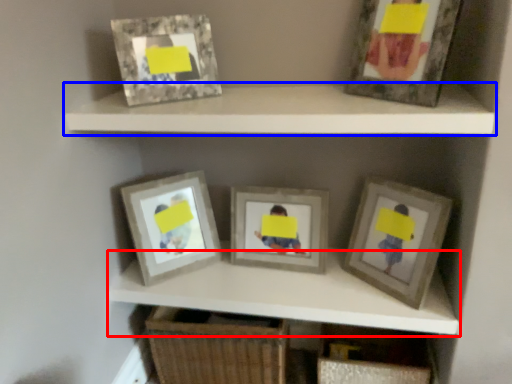
Question: Which point is closer to the camera, cabinet (highlighted by a red box) or shelf (highlighted by a blue box)?

Choices:
 (A) cabinet
 (B) shelf

Answer: (B)